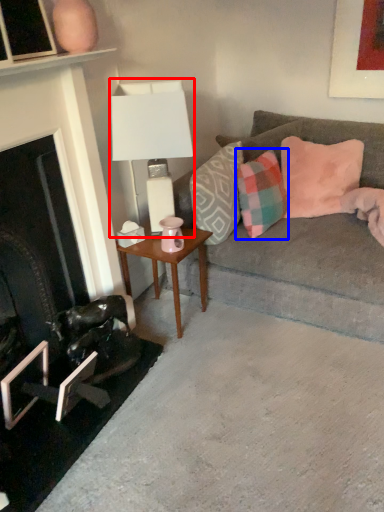
Question: Which object appears closest to the camera in this image, table lamp (highlighted by a red box) or pillow (highlighted by a blue box)?

Choices:
 (A) table lamp
 (B) pillow

Answer: (A)